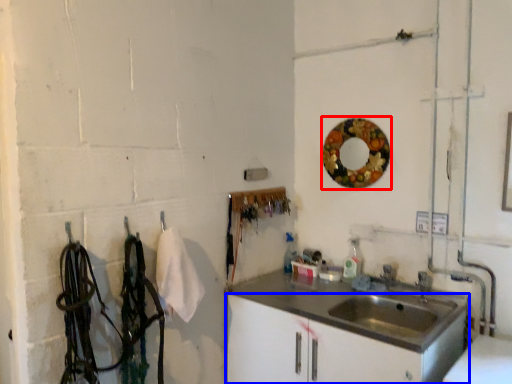
Question: Which object is closer to the camera taking this photo, mirror (highlighted by a red box) or bathroom cabinet (highlighted by a blue box)?

Choices:
 (A) mirror
 (B) bathroom cabinet

Answer: (B)